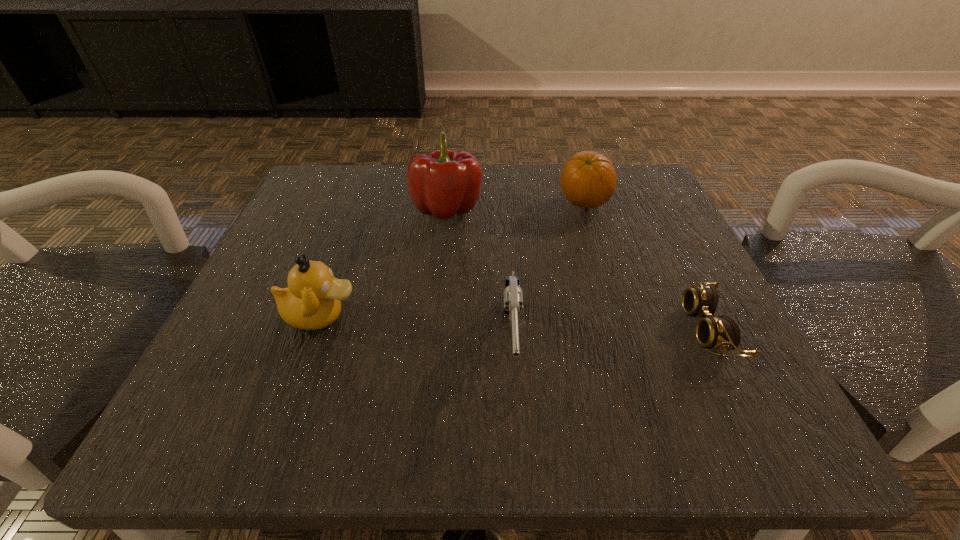
Locate an element on the screen. The image size is (960, 540). vacant area at the near edge is located at coordinates (367, 425).

At what (x,y) coordinates should I click in order to perform the action: click on blank space at the left edge of the desktop. Please return your answer as a coordinate pair (x, y). The image size is (960, 540). Looking at the image, I should click on (309, 355).

In the image, there is a desktop. At what (x,y) coordinates should I click in order to perform the action: click on free space at the right edge. Please return your answer as a coordinate pair (x, y). Looking at the image, I should click on (637, 343).

Identify the location of free region at the far left corner of the desktop. The image size is (960, 540). tap(359, 171).

Image resolution: width=960 pixels, height=540 pixels. What are the coordinates of `vacant space at the near left corner of the desktop` in the screenshot? It's located at (185, 410).

The height and width of the screenshot is (540, 960). What are the coordinates of `vacant space at the near right corner of the desktop` in the screenshot? It's located at (677, 397).

Locate an element on the screen. The image size is (960, 540). vacant point located between the fourth object from left to right and the goggles is located at coordinates (646, 266).

Find the location of a particular element. This screenshot has width=960, height=540. blank region between the gun and the pepper is located at coordinates (479, 276).

In order to click on vacant region between the goggles and the pepper in this screenshot , I will do `click(578, 269)`.

The height and width of the screenshot is (540, 960). In order to click on free point between the rightmost object and the orange in this screenshot , I will do `click(646, 266)`.